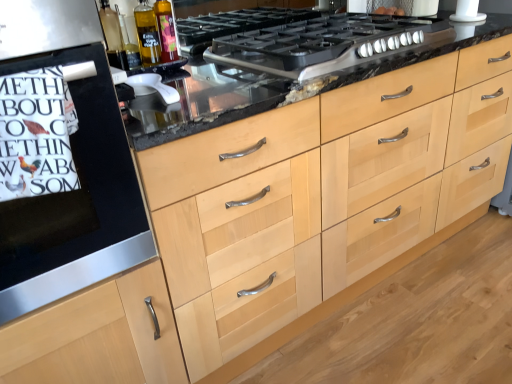
Question: Based on their positions, is white paper towel at left located to the left or right of white plastic juicer at center, positioned as the first appliance in bottom-to-top order?

Choices:
 (A) left
 (B) right

Answer: (A)

Question: Is white paper towel at left bigger or smaller than white plastic juicer at center, positioned as the first appliance in bottom-to-top order?

Choices:
 (A) small
 (B) big

Answer: (B)

Question: Estimate the real-world distances between objects in this image. Which object is closer to the black matte oven at left?

Choices:
 (A) translucent glass bottle at upper center, which appears as the 2th bottle when viewed from the right
 (B) white plastic juicer at center, which appears as the second appliance when viewed from the top
 (C) white paper towel at left
 (D) black matte gas stove at center
 (E) white matte plastic pipe at upper right, the 2th appliance positioned from the bottom

Answer: (C)

Question: Which object is positioned farthest from the white matte plastic pipe at upper right, the 2th appliance positioned from the bottom?

Choices:
 (A) translucent glass bottle at upper left, which is the first bottle from right to left
 (B) white plastic juicer at center, which appears as the second appliance when viewed from the top
 (C) black matte oven at left
 (D) white paper towel at left
 (E) black matte gas stove at center

Answer: (D)